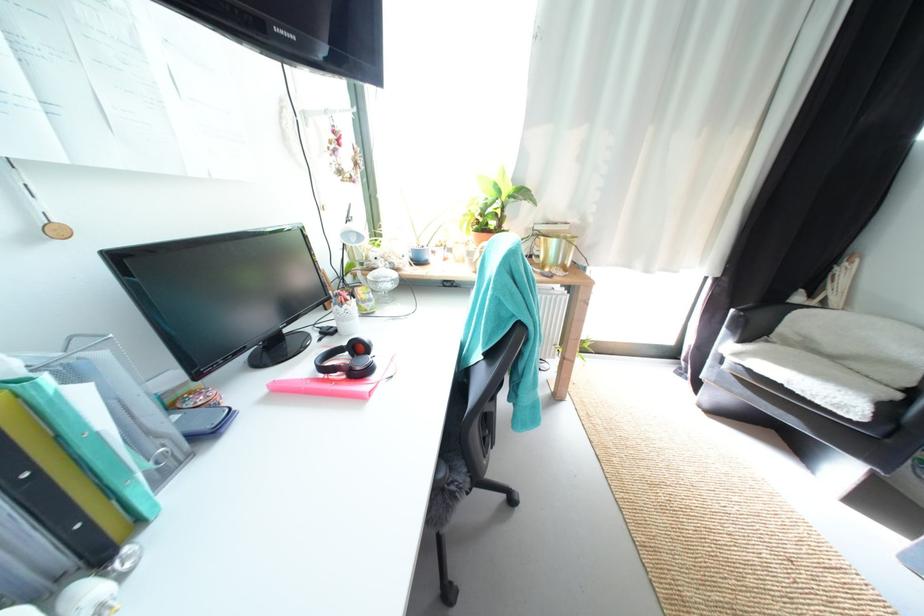
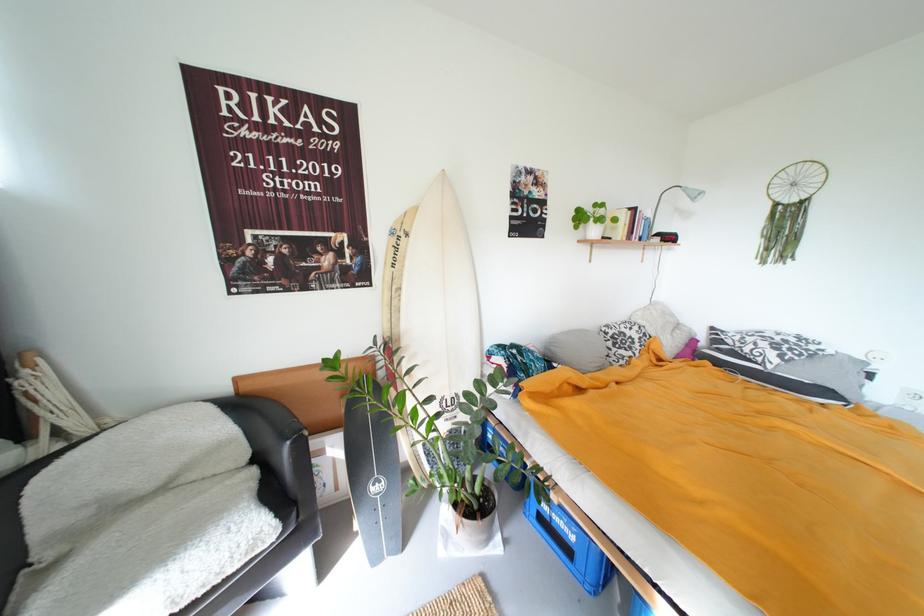
Where in the second image is the point corresponding to the point at 878,416 from the first image?

(284, 524)